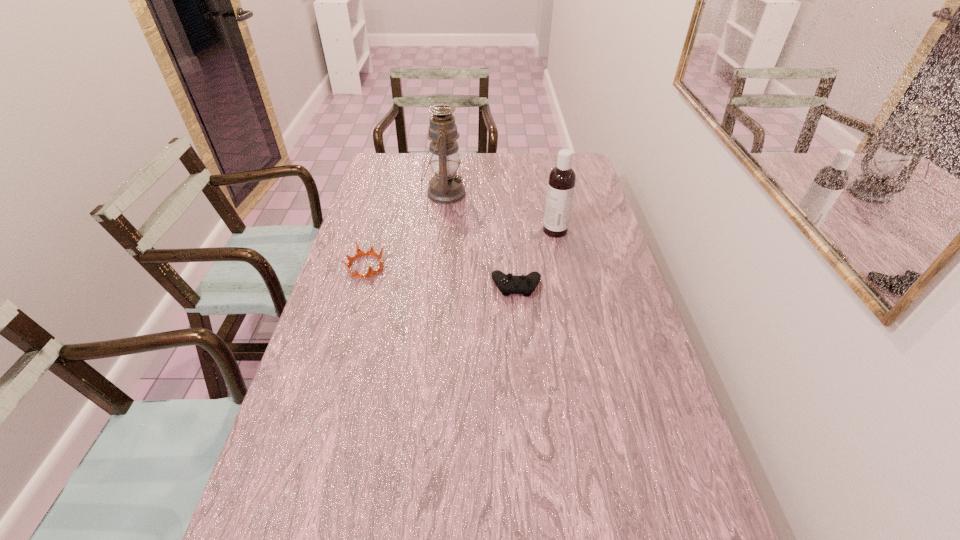
Identify the location of the farthest object. point(445,187).

Locate an element on the screen. Image resolution: width=960 pixels, height=540 pixels. oil lamp is located at coordinates (445, 187).

Locate an element on the screen. dishwasher detergent is located at coordinates (561, 183).

Where is `the third shortest object`? Image resolution: width=960 pixels, height=540 pixels. the third shortest object is located at coordinates (561, 183).

You are a GUI agent. You are given a task and a screenshot of the screen. Output one action in this format:
    pyautogui.click(x=<x>, y=<y>)
    Task: Click on the second shortest object
    Image resolution: width=960 pixels, height=540 pixels.
    Given the screenshot: What is the action you would take?
    pyautogui.click(x=359, y=253)

Locate an element on the screen. The image size is (960, 540). crown is located at coordinates (359, 253).

You are a GUI agent. You are given a task and a screenshot of the screen. Output one action in this format:
    pyautogui.click(x=<x>, y=<y>)
    Task: Click on the third object from left to right
    Image resolution: width=960 pixels, height=540 pixels.
    Given the screenshot: What is the action you would take?
    pyautogui.click(x=508, y=284)

This screenshot has width=960, height=540. Identify the location of the shortest object. (508, 284).

This screenshot has height=540, width=960. In order to click on free space located on the front of the oil lamp in this screenshot , I will do `click(436, 269)`.

You are a GUI agent. You are given a task and a screenshot of the screen. Output one action in this format:
    pyautogui.click(x=<x>, y=<y>)
    Task: Click on the vacant space located 0.160m on the label side of the dishwasher detergent
    The image size is (960, 540).
    Given the screenshot: What is the action you would take?
    pyautogui.click(x=497, y=231)